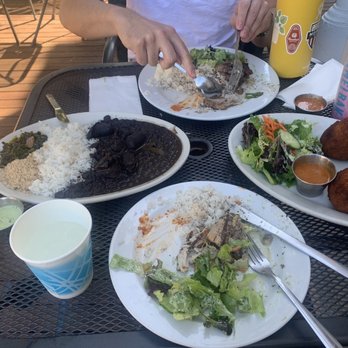
Locate an element on the screen. table iron wrought is located at coordinates (73, 315).